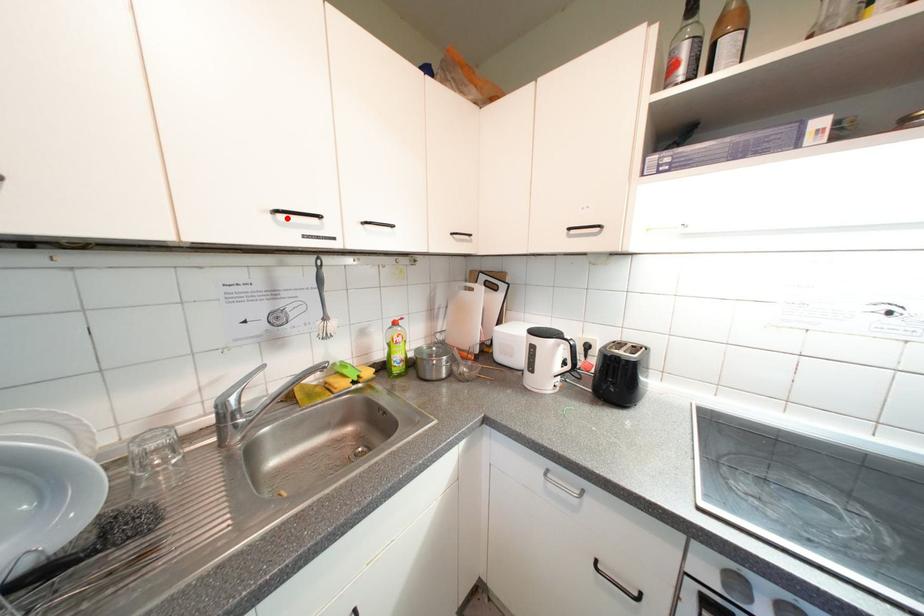
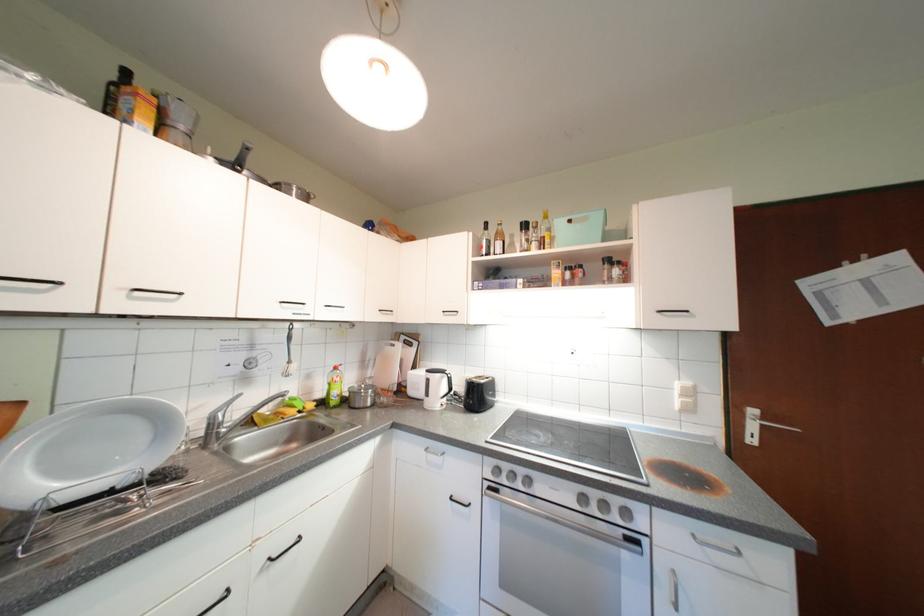
Find the pixel in the second image that matches the highlighted location in the first image.

(292, 306)